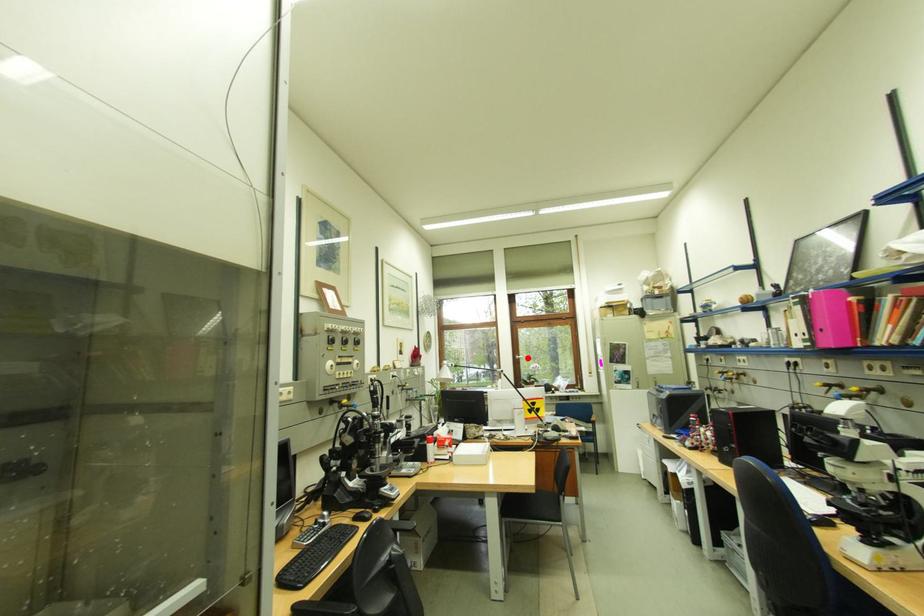
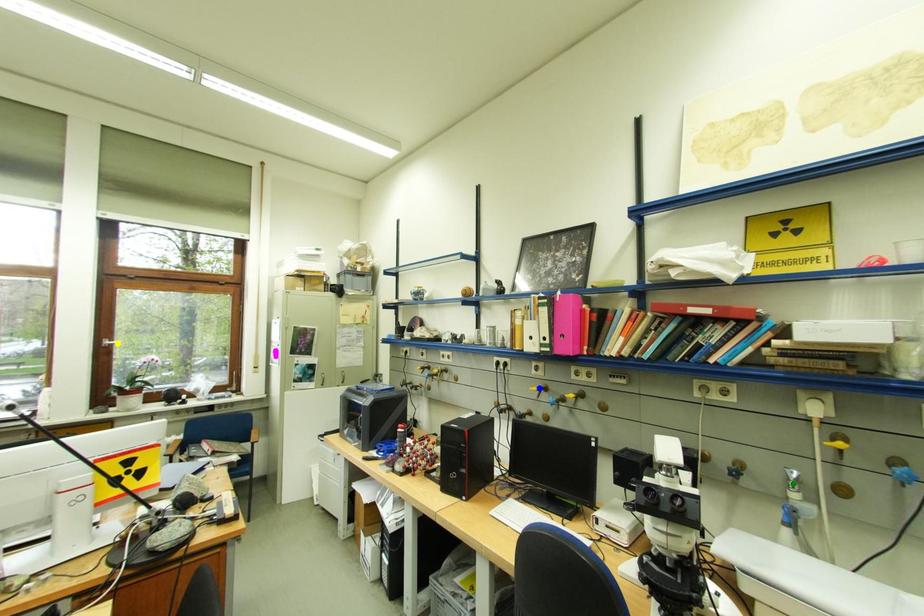
Question: I am providing you with two images of the same scene from different viewpoints. A red point is marked on the first image. You are given multiple points on the second image. Which point in image 2 is actually the same real-world point as the red point in image 1?

Choices:
 (A) yellow point
 (B) blue point
 (C) green point

Answer: (A)